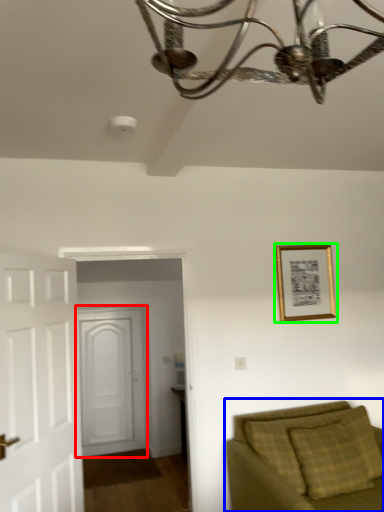
Question: Estimate the real-world distances between objects in this image. Which object is closer to door (highlighted by a red box), studio couch (highlighted by a blue box) or picture frame (highlighted by a green box)?

Choices:
 (A) studio couch
 (B) picture frame

Answer: (B)